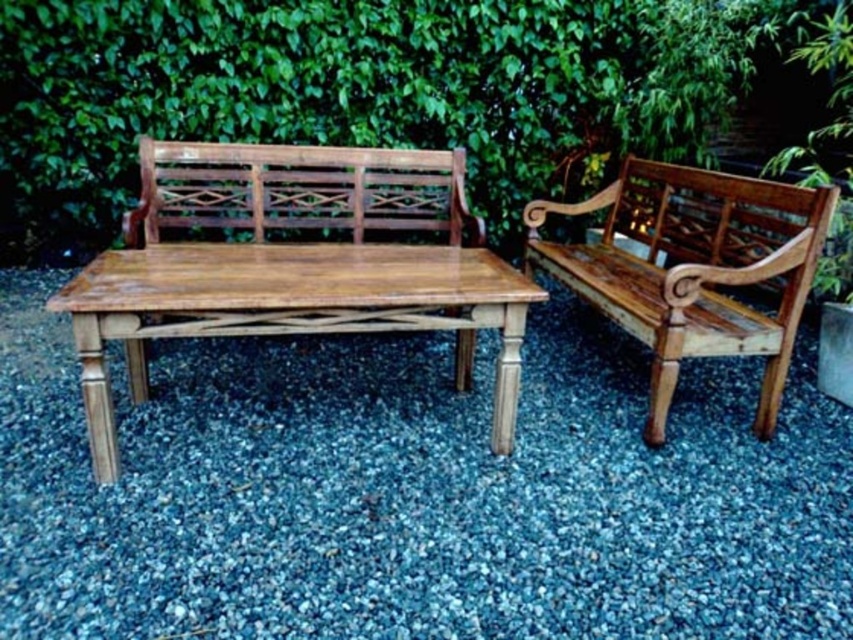
Who is more distant from viewer, (664, 307) or (341, 170)?

The point (341, 170) is behind.

Which is behind, point (799, 193) or point (291, 195)?

Positioned behind is point (291, 195).

Locate an element on the screen. teak wood bench at right is located at coordinates (693, 268).

Is light brown wood bench at center smaller than teak wood bench at right?

Incorrect, light brown wood bench at center is not smaller in size than teak wood bench at right.

Looking at this image, between light brown wood bench at center and teak wood bench at right, which one is positioned higher?

Positioned higher is teak wood bench at right.

Who is more distant from viewer, [94,381] or [654,440]?

Point [654,440]

Where is `light brown wood bench at center`? light brown wood bench at center is located at coordinates (292, 264).

Is smooth gray gravel at center taller than light brown wood bench at center?

No.

Identify the location of smooth gray gravel at center. tap(415, 490).